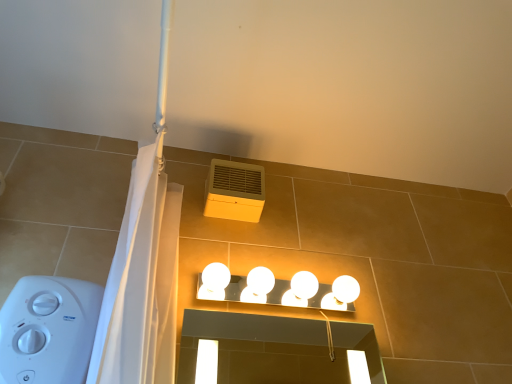
Question: Is white glossy light fixture at upper center further to the viewer compared to yellow matte air conditioning at upper center?

Choices:
 (A) no
 (B) yes

Answer: (A)

Question: Does white glossy light fixture at upper center lie in front of yellow matte air conditioning at upper center?

Choices:
 (A) no
 (B) yes

Answer: (B)

Question: From a real-world perspective, is white glossy light fixture at upper center over yellow matte air conditioning at upper center?

Choices:
 (A) yes
 (B) no

Answer: (B)

Question: Considering the relative positions of white glossy light fixture at upper center and yellow matte air conditioning at upper center in the image provided, is white glossy light fixture at upper center to the left of yellow matte air conditioning at upper center from the viewer's perspective?

Choices:
 (A) yes
 (B) no

Answer: (B)

Question: Is white glossy light fixture at upper center thinner than yellow matte air conditioning at upper center?

Choices:
 (A) no
 (B) yes

Answer: (A)

Question: Is white glossy light fixture at upper center next to yellow matte air conditioning at upper center and touching it?

Choices:
 (A) no
 (B) yes

Answer: (A)

Question: Can you confirm if yellow matte air conditioning at upper center is wider than white glossy light fixture at upper center?

Choices:
 (A) no
 (B) yes

Answer: (A)

Question: Is yellow matte air conditioning at upper center with white glossy light fixture at upper center?

Choices:
 (A) no
 (B) yes

Answer: (A)

Question: Is white glossy light fixture at upper center located within yellow matte air conditioning at upper center?

Choices:
 (A) yes
 (B) no

Answer: (B)

Question: Is yellow matte air conditioning at upper center at the right side of white glossy light fixture at upper center?

Choices:
 (A) no
 (B) yes

Answer: (A)

Question: From the image's perspective, does yellow matte air conditioning at upper center appear higher than white glossy light fixture at upper center?

Choices:
 (A) no
 (B) yes

Answer: (B)

Question: Is yellow matte air conditioning at upper center bigger than white glossy light fixture at upper center?

Choices:
 (A) no
 (B) yes

Answer: (A)

Question: Is point (221, 215) closer or farther from the camera than point (349, 301)?

Choices:
 (A) farther
 (B) closer

Answer: (A)